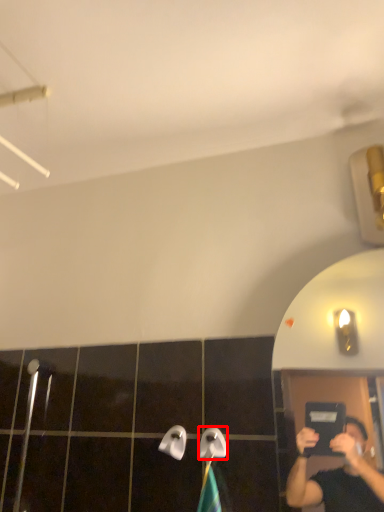
Question: In this image, where is towel bar (annotated by the red box) located relative to towel bar?

Choices:
 (A) right
 (B) left

Answer: (A)